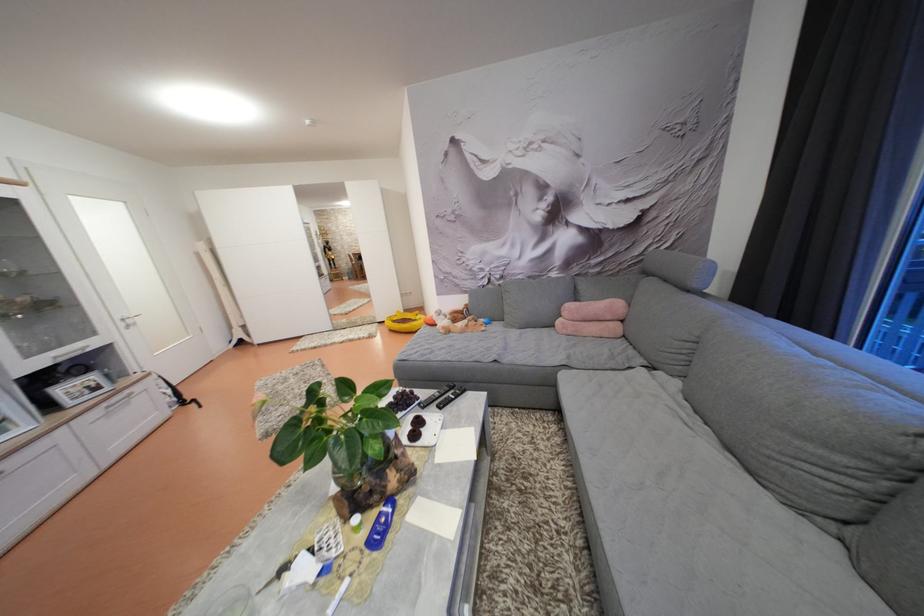
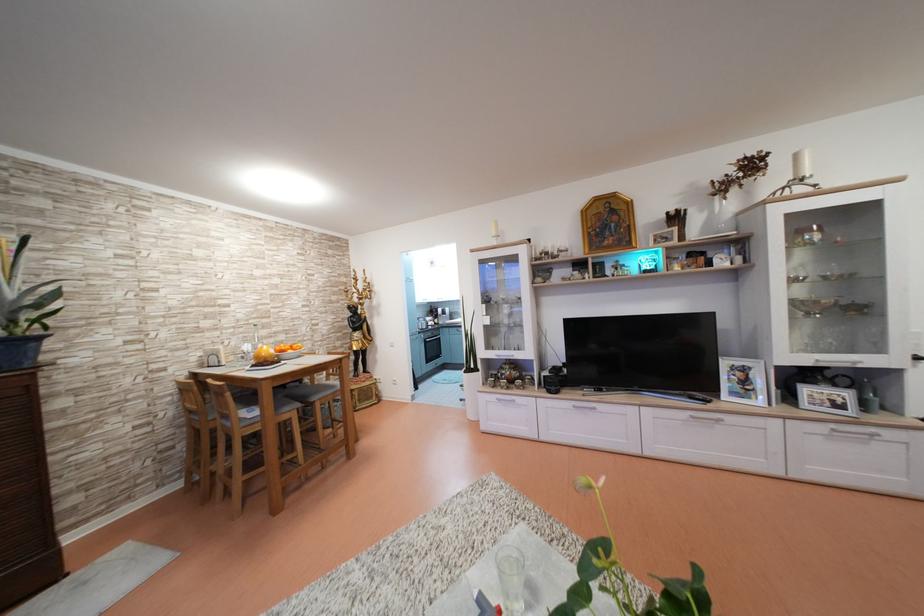
Where in the second image is the point corresponding to (112,410) from the first image?

(840, 431)